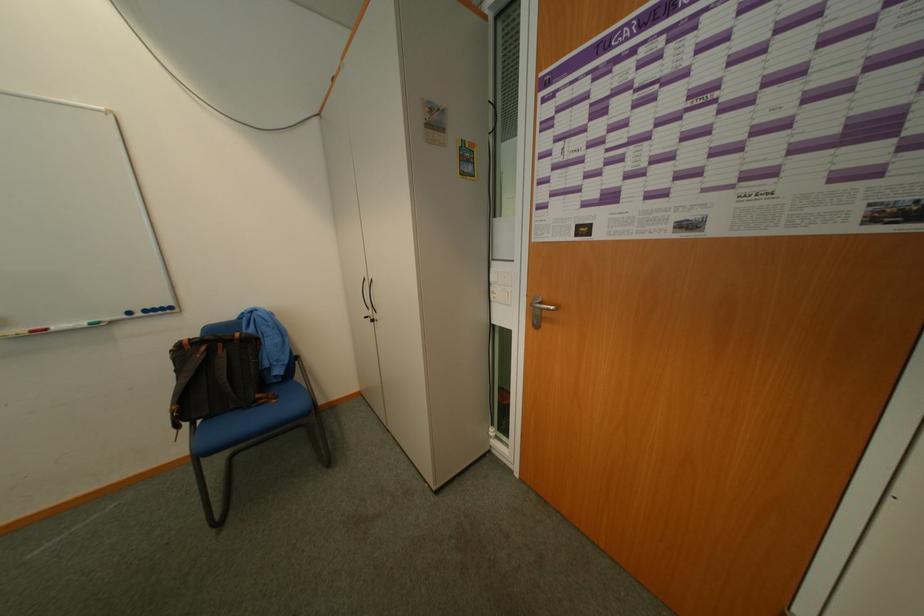
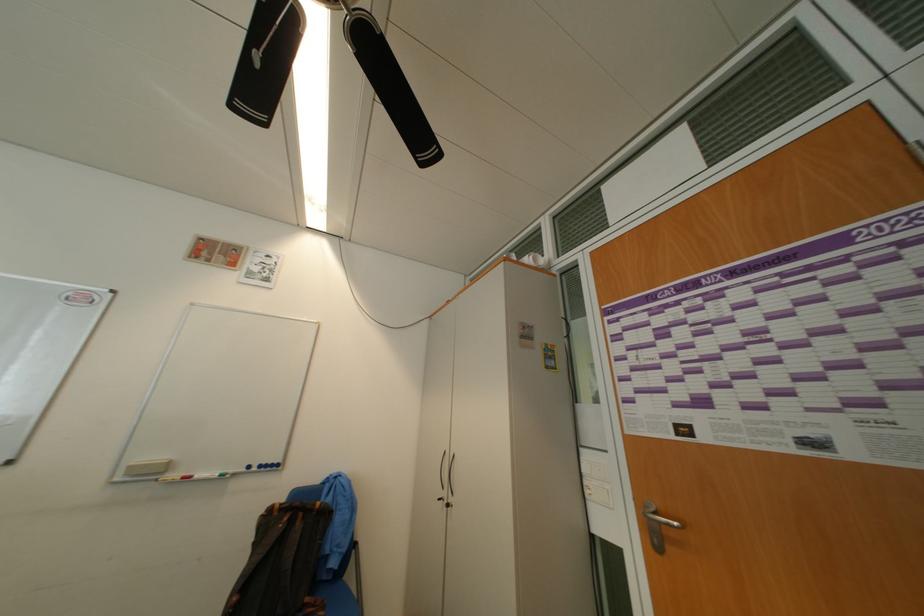
Locate, in the second image, the point that corresponds to the point at 552,310 in the first image.

(670, 524)